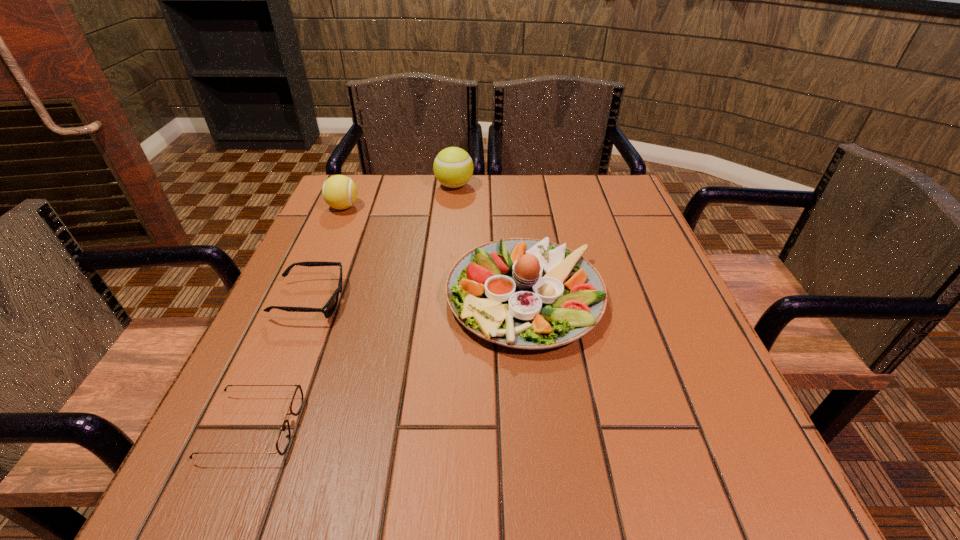
I want to click on the farthest object, so click(453, 167).

The width and height of the screenshot is (960, 540). Find the location of `the taller tennis ball`. the taller tennis ball is located at coordinates (453, 167).

You are a GUI agent. You are given a task and a screenshot of the screen. Output one action in this format:
    pyautogui.click(x=<x>, y=<y>)
    Task: Click on the salad plate
    The width and height of the screenshot is (960, 540).
    Given the screenshot: What is the action you would take?
    pyautogui.click(x=522, y=293)

This screenshot has height=540, width=960. I want to click on the left tennis ball, so click(x=340, y=192).

This screenshot has width=960, height=540. In order to click on the nearer tennis ball in this screenshot , I will do `click(340, 192)`.

This screenshot has height=540, width=960. In order to click on the farther sunglasses in this screenshot , I will do `click(329, 308)`.

At what (x,y) coordinates should I click in order to perform the action: click on the nearest object. Please return your answer as a coordinate pair (x, y). Looking at the image, I should click on (283, 439).

The width and height of the screenshot is (960, 540). Find the location of `the shorter sunglasses`. the shorter sunglasses is located at coordinates [x=283, y=439].

Find the location of a particular element. Image resolution: width=960 pixels, height=540 pixels. vacant space located 0.230m on the right of the farthest object is located at coordinates click(x=555, y=186).

Locate an element on the screen. This screenshot has width=960, height=540. free space located 0.110m on the right of the salad plate is located at coordinates (657, 296).